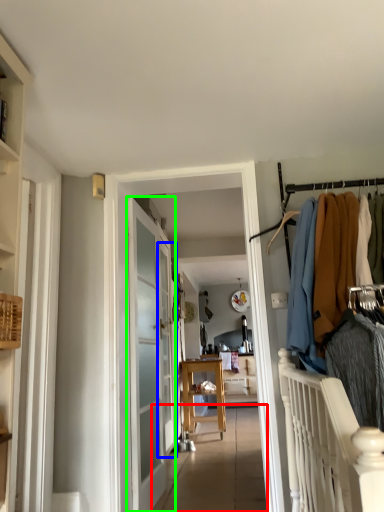
Question: Which object is the farthest from path (highlighted by a red box)? Choose among these: screen door (highlighted by a blue box) or door (highlighted by a green box).

Choices:
 (A) screen door
 (B) door

Answer: (B)